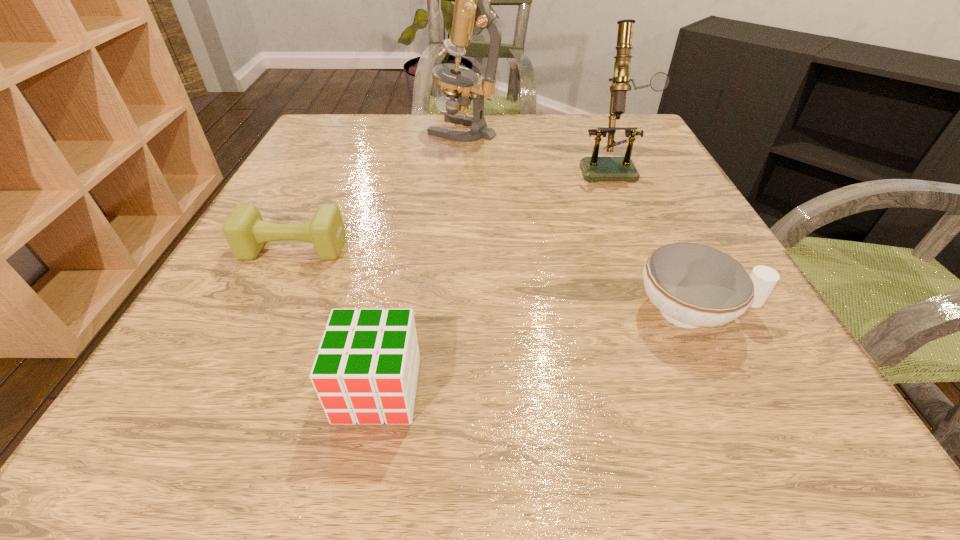
In the image, there is a desktop. At what (x,y) coordinates should I click in order to perform the action: click on vacant space at the right edge. Please return your answer as a coordinate pair (x, y). Looking at the image, I should click on (776, 347).

Locate an element on the screen. The image size is (960, 540). free space at the far left corner of the desktop is located at coordinates (321, 129).

In the image, there is a desktop. Identify the location of vacant space at the near left corner. (123, 437).

The width and height of the screenshot is (960, 540). In the image, there is a desktop. Identify the location of vacant region at the near right corner. (769, 445).

Locate an element on the screen. The height and width of the screenshot is (540, 960). vacant space that's between the taller microscope and the leftmost object is located at coordinates (378, 190).

Locate an element on the screen. vacant space that is in between the cube and the taller microscope is located at coordinates (420, 260).

This screenshot has height=540, width=960. I want to click on free spot between the third tallest object and the tallest object, so click(420, 260).

The image size is (960, 540). Find the location of `free space between the tallest object and the leftmost object`. free space between the tallest object and the leftmost object is located at coordinates (378, 190).

This screenshot has height=540, width=960. Identify the location of vacant point located between the second nearest object and the tallest object. (579, 221).

Locate an element on the screen. The height and width of the screenshot is (540, 960). free area in between the left microscope and the chinaware is located at coordinates (579, 221).